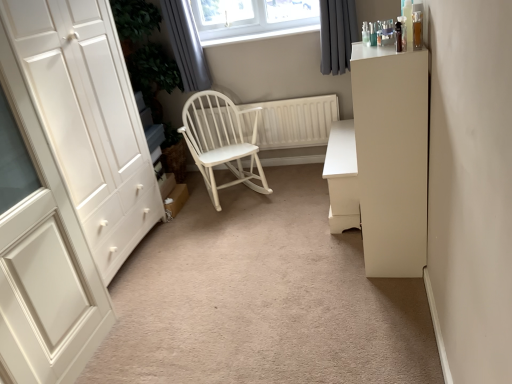
Question: Is dark grey fabric curtain at upper right, the 1th curtain in the right-to-left sequence, at the back of white wood radiator at center?

Choices:
 (A) no
 (B) yes

Answer: (A)

Question: Does white wood radiator at center come in front of dark grey fabric curtain at upper right, the second curtain when ordered from left to right?

Choices:
 (A) yes
 (B) no

Answer: (B)

Question: Is white wood radiator at center thinner than dark grey fabric curtain at upper right, the 1th curtain in the right-to-left sequence?

Choices:
 (A) no
 (B) yes

Answer: (B)

Question: Does white wood radiator at center have a lesser height compared to dark grey fabric curtain at upper right, the 1th curtain in the right-to-left sequence?

Choices:
 (A) no
 (B) yes

Answer: (B)

Question: Is white wood radiator at center not inside dark grey fabric curtain at upper right, the second curtain when ordered from left to right?

Choices:
 (A) no
 (B) yes

Answer: (B)

Question: Relative to white matte cabinet at right, is dark grey fabric curtain at upper right, the 1th curtain in the right-to-left sequence, in front or behind?

Choices:
 (A) behind
 (B) front

Answer: (A)

Question: Considering the positions of dark grey fabric curtain at upper right, the second curtain when ordered from left to right, and white matte cabinet at right in the image, is dark grey fabric curtain at upper right, the second curtain when ordered from left to right, wider or thinner than white matte cabinet at right?

Choices:
 (A) thin
 (B) wide

Answer: (A)

Question: From a real-world perspective, relative to white matte cabinet at right, is dark grey fabric curtain at upper right, the 1th curtain in the right-to-left sequence, vertically above or below?

Choices:
 (A) above
 (B) below

Answer: (A)

Question: Is dark grey fabric curtain at upper right, the second curtain when ordered from left to right, taller or shorter than white matte cabinet at right?

Choices:
 (A) tall
 (B) short

Answer: (B)

Question: In terms of height, does gray fabric curtain at upper center, which is counted as the second curtain, starting from the right, look taller or shorter compared to white matte chest of drawers at center?

Choices:
 (A) short
 (B) tall

Answer: (B)

Question: Is point (189, 34) closer or farther from the camera than point (329, 165)?

Choices:
 (A) farther
 (B) closer

Answer: (A)

Question: Is gray fabric curtain at upper center, which appears as the first curtain when viewed from the left, bigger or smaller than white matte chest of drawers at center?

Choices:
 (A) big
 (B) small

Answer: (B)

Question: Is gray fabric curtain at upper center, which is counted as the second curtain, starting from the right, in front of or behind white matte chest of drawers at center in the image?

Choices:
 (A) front
 (B) behind

Answer: (B)

Question: Which is correct: white wood rocking chair at center is inside dark grey fabric curtain at upper right, the second curtain when ordered from left to right, or outside of it?

Choices:
 (A) outside
 (B) inside

Answer: (A)

Question: Does point (189, 142) appear closer or farther from the camera than point (342, 16)?

Choices:
 (A) closer
 (B) farther

Answer: (B)